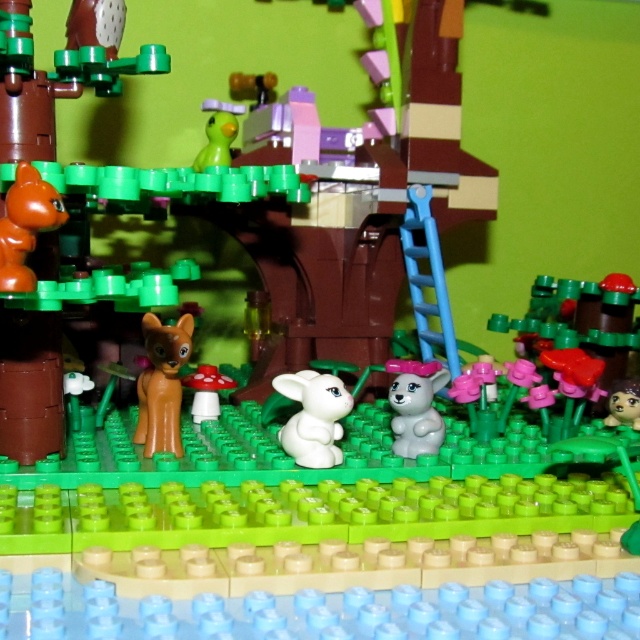
You are a child who wants to give a toy to both the orange matte cat at left and the brown matte rabbit at center in the LEGO diorama. If you can only reach up to 25 inches, can you hand the toys to both without moving your position?

The orange matte cat at left is 27.03 inches away from the brown matte rabbit at center. Since the child can only reach up to 25 inches, they cannot reach the orange matte cat at left, which is farther than their reach. The brown matte rabbit at center is within reach, but since the cat is out of reach, the child cannot hand toys to both without moving.

You are a photographer taking a picture of the LEGO diorama. You notice two points in the scene labeled as point (x=140, y=416) and point (x=35, y=211). Which point is closer to the camera?

Point (x=35, y=211) is closer to the camera because it is positioned behind point (x=140, y=416), which is further away.

In the LEGO diorama, there is an orange matte cat at left and a brown matte rabbit at center. Which one is positioned more to the left side of the scene?

The orange matte cat at left is positioned more to the left side of the scene than the brown matte rabbit at center.